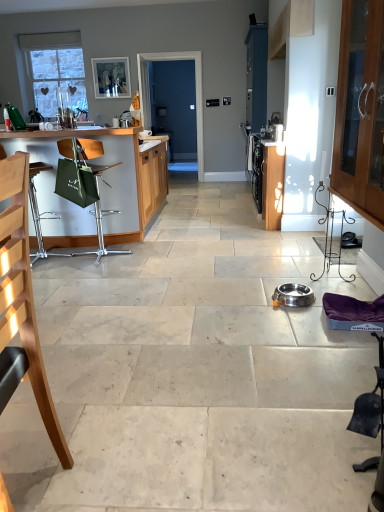
The height and width of the screenshot is (512, 384). What do you see at coordinates (22, 304) in the screenshot?
I see `wooden chair at left, the first chair positioned from the front` at bounding box center [22, 304].

The width and height of the screenshot is (384, 512). What are the coordinates of `matte white picture frame at upper center` in the screenshot? It's located at (111, 77).

In order to face green fabric bag at left, should I rotate leftwards or rightwards?

Rotate left and turn 20.408 degrees.

What do you see at coordinates (38, 212) in the screenshot?
I see `green fabric bag at left` at bounding box center [38, 212].

This screenshot has width=384, height=512. In order to click on green fabric chair at left, placed as the first chair when sorted from back to front in this screenshot , I will do `click(97, 192)`.

What is the approximate width of green fabric chair at left, which ranks as the 2th chair in front-to-back order?

green fabric chair at left, which ranks as the 2th chair in front-to-back order, is 17.99 inches in width.

Describe the element at coordinates (100, 185) in the screenshot. I see `metallic green bag at left` at that location.

Where is `wooden chair at left, the first chair positioned from the front`? This screenshot has height=512, width=384. wooden chair at left, the first chair positioned from the front is located at coordinates (22, 304).

Is wooden cabinet with glass doors at right closer to the viewer compared to stainless steel bowl at center?

Yes, wooden cabinet with glass doors at right is closer to the viewer.

Is wooden cabinet with glass doors at right inside or outside of stainless steel bowl at center?

wooden cabinet with glass doors at right is not enclosed by stainless steel bowl at center.

Locate an element on the screen. The height and width of the screenshot is (512, 384). appliance behind the wooden cabinet with glass doors at right is located at coordinates (293, 295).

From the image's perspective, which is above, wooden cabinet with glass doors at right or stainless steel bowl at center?

wooden cabinet with glass doors at right, from the image's perspective.

Is metallic silver bowl at center facing towards blue glossy screen door at center?

No, metallic silver bowl at center does not turn towards blue glossy screen door at center.

Which of these two, metallic silver bowl at center or blue glossy screen door at center, stands shorter?

With less height is metallic silver bowl at center.

Is metallic silver bowl at center wider than blue glossy screen door at center?

Correct, the width of metallic silver bowl at center exceeds that of blue glossy screen door at center.

In the image, is metallic silver bowl at center positioned in front of or behind blue glossy screen door at center?

metallic silver bowl at center is in front of blue glossy screen door at center.

Which object is wider, matte white picture frame at upper center or wooden chair at left, the first chair positioned from the front?

wooden chair at left, the first chair positioned from the front.

Is matte white picture frame at upper center to the right of wooden chair at left, which appears as the 2th chair when viewed from the back, from the viewer's perspective?

In fact, matte white picture frame at upper center is to the left of wooden chair at left, which appears as the 2th chair when viewed from the back.

Is point (123, 70) closer or farther from the camera than point (25, 203)?

Point (123, 70) appears to be farther away from the viewer than point (25, 203).

Is matte white picture frame at upper center outside of wooden chair at left, which appears as the 2th chair when viewed from the back?

Yes, matte white picture frame at upper center is not within wooden chair at left, which appears as the 2th chair when viewed from the back.

Is metallic silver bowl at center wider or thinner than green fabric bag at left?

Considering their sizes, metallic silver bowl at center looks broader than green fabric bag at left.

Is the surface of metallic silver bowl at center in direct contact with green fabric bag at left?

No, metallic silver bowl at center is not with green fabric bag at left.

Which of these two, metallic silver bowl at center or green fabric bag at left, stands taller?

green fabric bag at left.

Is there a large distance between green fabric bag at left and metallic silver bowl at center?

Indeed, green fabric bag at left is not near metallic silver bowl at center.

From a real-world perspective, between green fabric bag at left and metallic silver bowl at center, who is vertically higher?

green fabric bag at left is physically above.

Considering the positions of points (38, 229) and (227, 507), is point (38, 229) farther from camera compared to point (227, 507)?

That is True.

From the picture: From the image's perspective, is green fabric bag at left located beneath metallic silver bowl at center?

Actually, green fabric bag at left appears above metallic silver bowl at center in the image.

From a real-world perspective, is black fabric swivel chair at lower right positioned above or below green fabric bag at left?

black fabric swivel chair at lower right is situated lower than green fabric bag at left in the real world.

From the image's perspective, is black fabric swivel chair at lower right on green fabric bag at left?

Actually, black fabric swivel chair at lower right appears below green fabric bag at left in the image.

Is there a large distance between black fabric swivel chair at lower right and green fabric bag at left?

Yes.

Who is shorter, black fabric swivel chair at lower right or green fabric bag at left?

Standing shorter between the two is black fabric swivel chair at lower right.

From the image's perspective, is green fabric bag at left on wooden chair at left, which appears as the 2th chair when viewed from the back?

Indeed, from the image's perspective, green fabric bag at left is shown above wooden chair at left, which appears as the 2th chair when viewed from the back.

Is green fabric bag at left closer to camera compared to wooden chair at left, which appears as the 2th chair when viewed from the back?

No.

From the picture: From a real-world perspective, relative to wooden chair at left, which appears as the 2th chair when viewed from the back, is green fabric bag at left vertically above or below?

Clearly, from a real-world perspective, green fabric bag at left is below wooden chair at left, which appears as the 2th chair when viewed from the back.

The image size is (384, 512). In the image, there is a wooden cabinet with glass doors at right. Find the location of `appliance below it (from a real-world perspective)`. appliance below it (from a real-world perspective) is located at coordinates [293, 295].

At what (x,y) coordinates should I click in order to perform the action: click on concrete to the right of blue glossy screen door at center. Please return your answer as a coordinate pair (x, y). Image resolution: width=384 pixels, height=512 pixels. Looking at the image, I should click on (193, 373).

Which object lies further to the anchor point black fabric swivel chair at lower right, blue glossy screen door at center or green fabric chair at left, which ranks as the 2th chair in front-to-back order?

Among the two, blue glossy screen door at center is located further to black fabric swivel chair at lower right.

Based on their spatial positions, is wooden cabinet with glass doors at right or blue glossy screen door at center further from black fabric swivel chair at lower right?

blue glossy screen door at center.

Based on their spatial positions, is wooden chair at left, the first chair positioned from the front, or metallic silver bowl at center further from stainless steel bowl at center?

wooden chair at left, the first chair positioned from the front, lies further to stainless steel bowl at center than the other object.

Based on their spatial positions, is green fabric bag at left or wooden cabinet with glass doors at right further from stainless steel bowl at center?

Among the two, green fabric bag at left is located further to stainless steel bowl at center.

Looking at the image, which one is located further to green fabric bag at left, metallic silver bowl at center or green fabric chair at left, placed as the first chair when sorted from back to front?

metallic silver bowl at center.

Based on the photo, which object lies nearer to the anchor point metallic silver bowl at center, blue glossy screen door at center or black fabric swivel chair at lower right?

Among the two, black fabric swivel chair at lower right is located nearer to metallic silver bowl at center.

From the image, which object appears to be farther from matte white picture frame at upper center, metallic silver bowl at center or green fabric chair at left, placed as the first chair when sorted from back to front?

metallic silver bowl at center.

From the image, which object appears to be nearer to metallic silver bowl at center, black fabric swivel chair at lower right or wooden chair at left, the first chair positioned from the front?

The object closer to metallic silver bowl at center is wooden chair at left, the first chair positioned from the front.

This screenshot has height=512, width=384. I want to click on swivel chair located between metallic silver bowl at center and green fabric bag at left in the depth direction, so click(x=371, y=404).

Find the location of `desk between green fabric chair at left, which ranks as the 2th chair in front-to-back order, and blue glossy screen door at center from front to back`. desk between green fabric chair at left, which ranks as the 2th chair in front-to-back order, and blue glossy screen door at center from front to back is located at coordinates (100, 185).

This screenshot has height=512, width=384. I want to click on desk between green fabric bag at left and green fabric chair at left, which ranks as the 2th chair in front-to-back order, from left to right, so click(x=100, y=185).

Identify the location of appliance between metallic silver bowl at center and matte white picture frame at upper center along the z-axis. (293, 295).